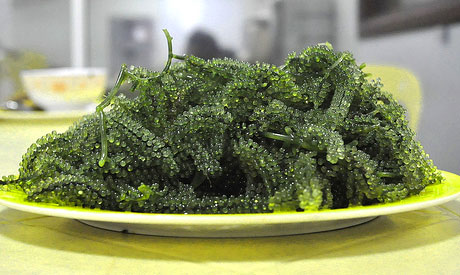
The image size is (460, 275). I want to click on green top face of plate, so click(x=436, y=191).